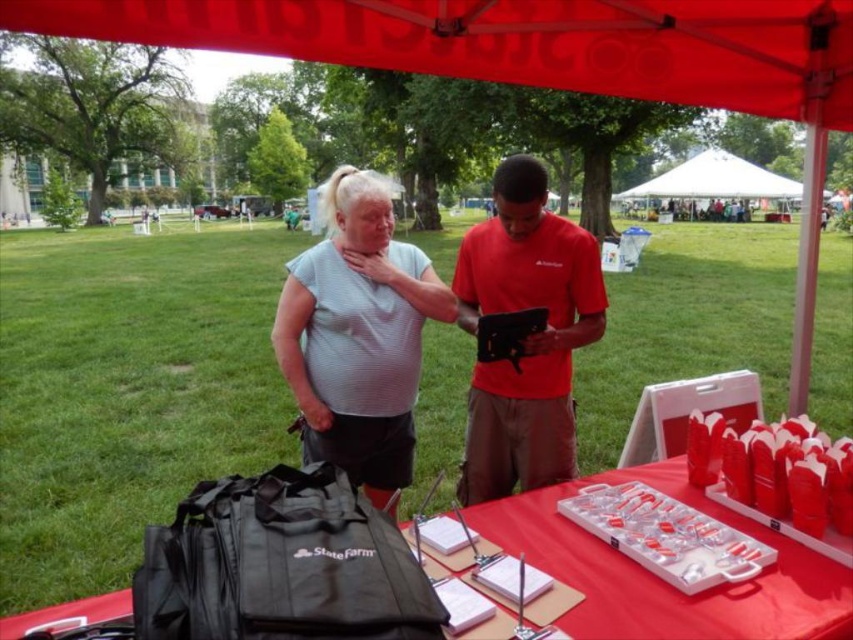
Question: Does red fabric canopy at upper center appear under gray striped shirt at center?

Choices:
 (A) no
 (B) yes

Answer: (A)

Question: Considering the real-world distances, which object is closest to the red matte shirt at center?

Choices:
 (A) red plastic tray at center
 (B) gray striped shirt at center

Answer: (B)

Question: Can you confirm if red fabric canopy at upper center is bigger than red plastic tray at center?

Choices:
 (A) no
 (B) yes

Answer: (B)

Question: Which is farther from the red fabric canopy at upper center?

Choices:
 (A) red plastic tray at center
 (B) red matte shirt at center

Answer: (A)

Question: Where is red matte shirt at center located in relation to red plastic tray at center in the image?

Choices:
 (A) right
 (B) left

Answer: (B)

Question: Estimate the real-world distances between objects in this image. Which object is closer to the red fabric canopy at upper center?

Choices:
 (A) gray striped shirt at center
 (B) red plastic tray at center
 (C) red matte shirt at center

Answer: (C)